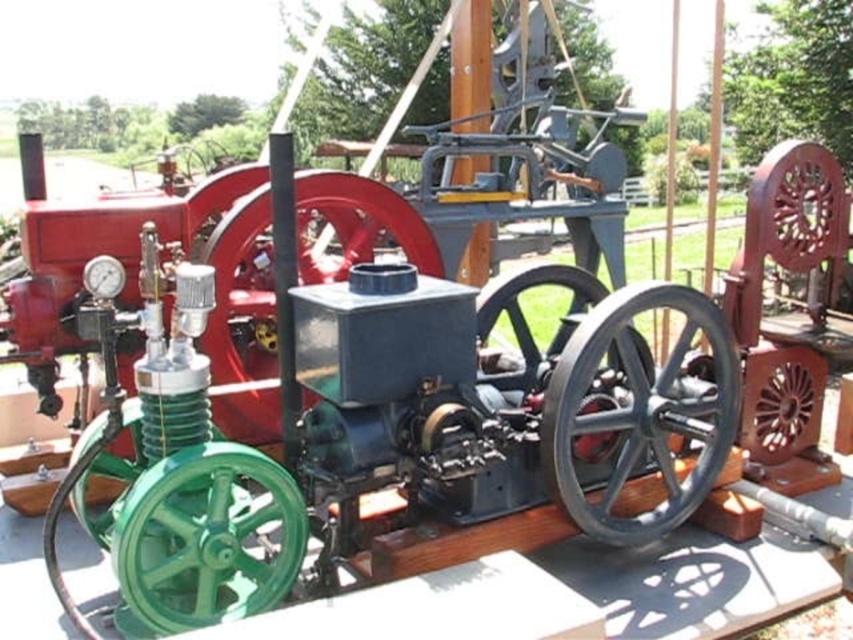
Can you confirm if red metal wheel at center is smaller than metallic gray gear at center?

Actually, red metal wheel at center might be larger than metallic gray gear at center.

In order to click on red metal wheel at center in this screenshot , I will do `click(239, 296)`.

Is point (627, 298) positioned in front of point (225, 266)?

That is True.

Does black metal wheel at center lie in front of red metal wheel at center?

Yes, black metal wheel at center is in front of red metal wheel at center.

Image resolution: width=853 pixels, height=640 pixels. I want to click on black metal wheel at center, so click(x=641, y=412).

Where is `black metal wheel at center`? The height and width of the screenshot is (640, 853). black metal wheel at center is located at coordinates (641, 412).

The image size is (853, 640). Find the location of `black metal wheel at center`. black metal wheel at center is located at coordinates (641, 412).

Can you confirm if black metal wheel at center is positioned above metallic gray gear at center?

No, black metal wheel at center is not above metallic gray gear at center.

Does point (668, 432) come behind point (596, 404)?

Yes.

Where is `black metal wheel at center`? The width and height of the screenshot is (853, 640). black metal wheel at center is located at coordinates (641, 412).